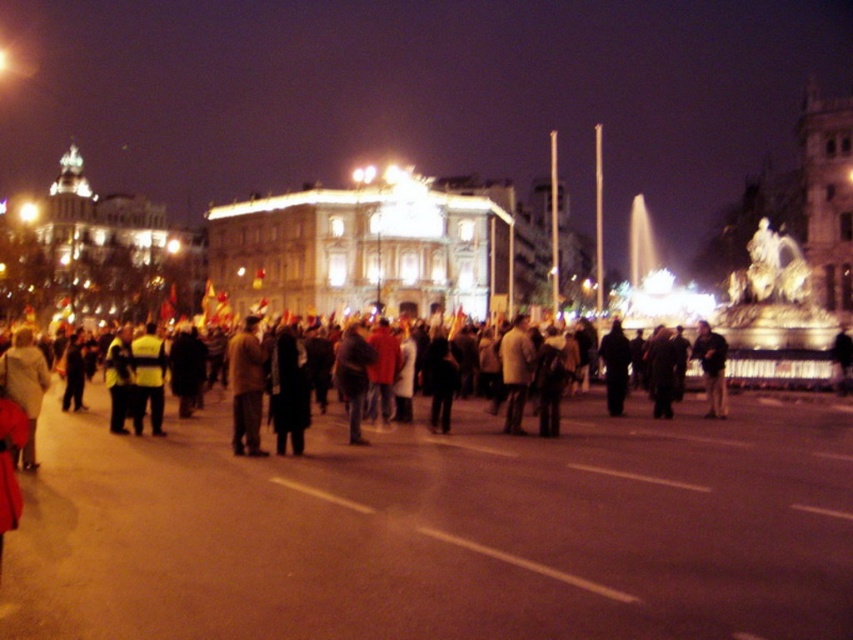
Question: Which object is closer to the camera taking this photo?

Choices:
 (A) dark brown coat at center
 (B) dark gray jacket at center
 (C) dark brown leather jacket at center

Answer: (A)

Question: Which point is farther to the camera?

Choices:
 (A) (80, 445)
 (B) (708, 323)

Answer: (B)

Question: Does dark brown coat at center have a greater width compared to dark brown leather jacket at center?

Choices:
 (A) yes
 (B) no

Answer: (A)

Question: Is dark gray clothing at center thinner than dark gray jacket at center?

Choices:
 (A) no
 (B) yes

Answer: (A)

Question: In this image, where is dark brown coat at center located relative to dark brown leather jacket at center?

Choices:
 (A) above
 (B) below

Answer: (A)

Question: Which point is closer to the camera?

Choices:
 (A) dark gray jacket at center
 (B) dark brown leather jacket at center
 (C) dark gray clothing at center
 (D) dark brown coat at center

Answer: (C)